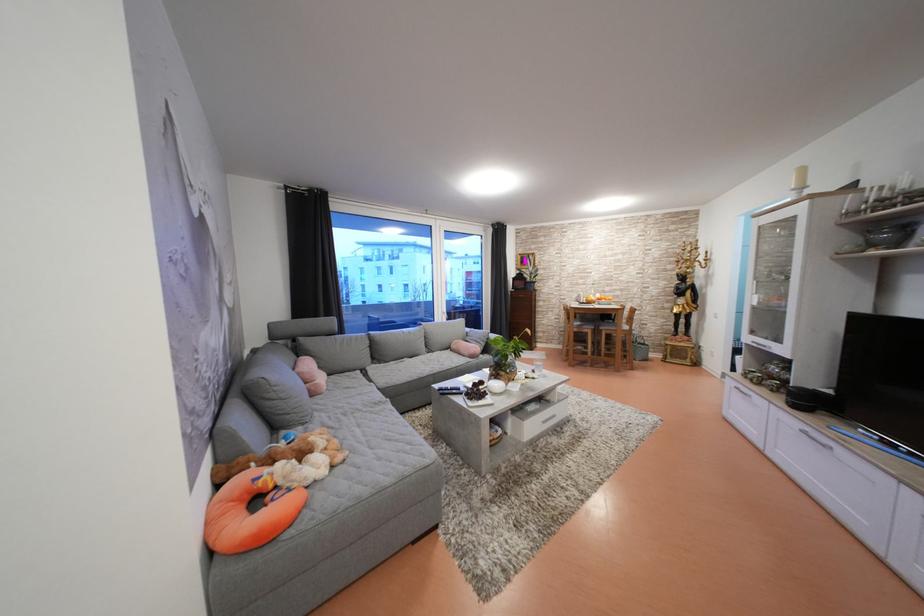
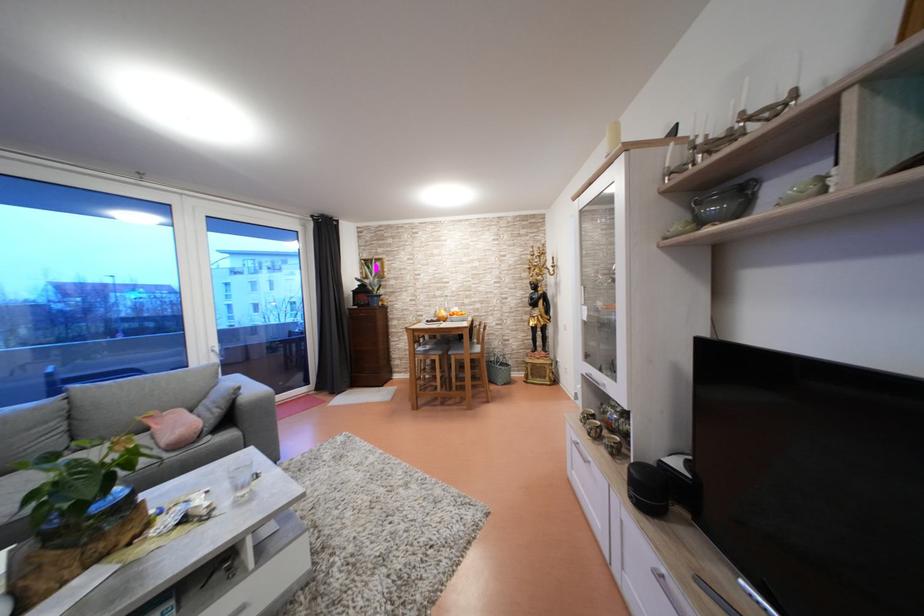
In the second image, find the point that corresponds to (x=813, y=407) in the first image.

(662, 500)